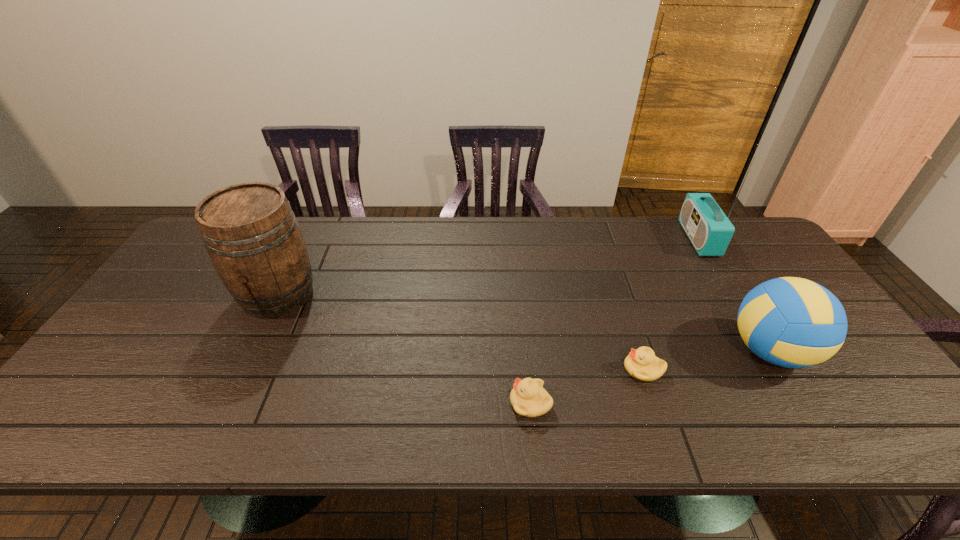
The image size is (960, 540). Identify the location of vacant area that lies between the farthest object and the leftmost object. (489, 267).

Identify the location of vacant space that is in between the third tallest object and the cider. (524, 323).

I want to click on unoccupied area between the radio receiver and the leftmost object, so coord(489,267).

The height and width of the screenshot is (540, 960). I want to click on free space between the left duckling and the leftmost object, so click(x=404, y=349).

Identify the location of object that is the third closest to the fourth object from right to left. (251, 234).

Identify the location of object that is the fourth closest one to the third tallest object. (251, 234).

You are a GUI agent. You are given a task and a screenshot of the screen. Output one action in this format:
    pyautogui.click(x=<x>, y=<y>)
    Task: Click on the vacant space that satisfies the following two spatial constraints: 1. on the front panel of the radio receiver; 2. on the left side of the volleyball
    The height and width of the screenshot is (540, 960).
    Given the screenshot: What is the action you would take?
    pyautogui.click(x=767, y=351)

You are a GUI agent. You are given a task and a screenshot of the screen. Output one action in this format:
    pyautogui.click(x=<x>, y=<y>)
    Task: Click on the vacant region that satisfies the following two spatial constraints: 1. on the front panel of the third tallest object; 2. on the left side of the farthest object
    This screenshot has height=540, width=960.
    Given the screenshot: What is the action you would take?
    pyautogui.click(x=767, y=351)

What are the coordinates of `vacant space that satisfies the following two spatial constraints: 1. on the front panel of the farthest object; 2. on the back side of the volleyball` in the screenshot? It's located at (767, 351).

You are a GUI agent. You are given a task and a screenshot of the screen. Output one action in this format:
    pyautogui.click(x=<x>, y=<y>)
    Task: Click on the vacant space that satisfies the following two spatial constraints: 1. on the front panel of the volleyball; 2. on the right side of the radio receiver
    The height and width of the screenshot is (540, 960).
    Given the screenshot: What is the action you would take?
    pyautogui.click(x=767, y=351)